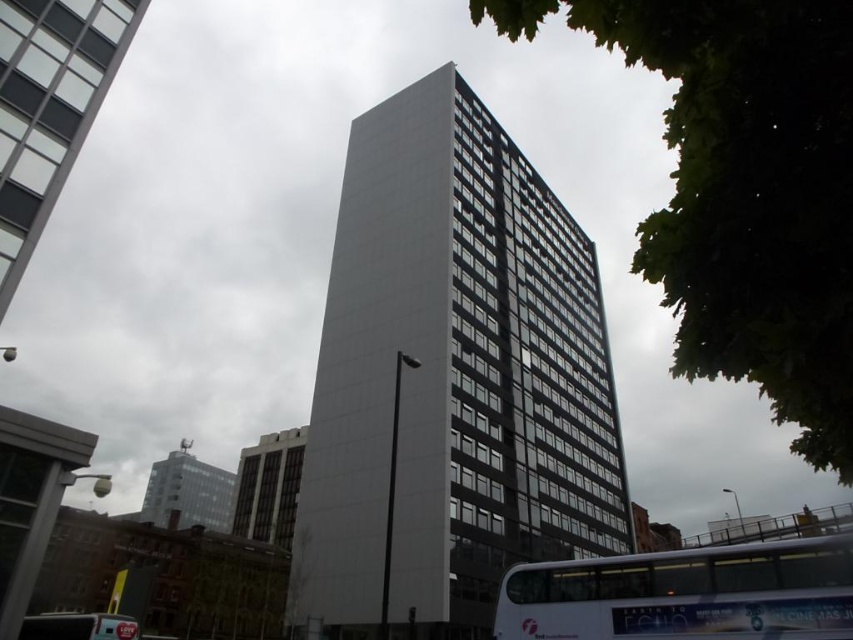
Question: Does white glass building at center appear on the left side of white plastic bus at lower left?

Choices:
 (A) no
 (B) yes

Answer: (A)

Question: Which point appears closest to the camera in this image?

Choices:
 (A) (527, 520)
 (B) (18, 40)
 (C) (88, 634)
 (D) (850, 570)

Answer: (D)

Question: Estimate the real-world distances between objects in this image. Which object is closer to the white glass building at center?

Choices:
 (A) white plastic bus at lower left
 (B) white glass building at upper left

Answer: (B)

Question: Does white glass double-decker bus at lower center have a larger size compared to white plastic bus at lower left?

Choices:
 (A) no
 (B) yes

Answer: (A)

Question: Among these points, which one is nearest to the camera?

Choices:
 (A) (122, 634)
 (B) (42, 52)
 (C) (347, 464)
 (D) (602, 592)

Answer: (D)

Question: Considering the relative positions of white glass building at center and white glass double-decker bus at lower center in the image provided, where is white glass building at center located with respect to white glass double-decker bus at lower center?

Choices:
 (A) below
 (B) above

Answer: (B)